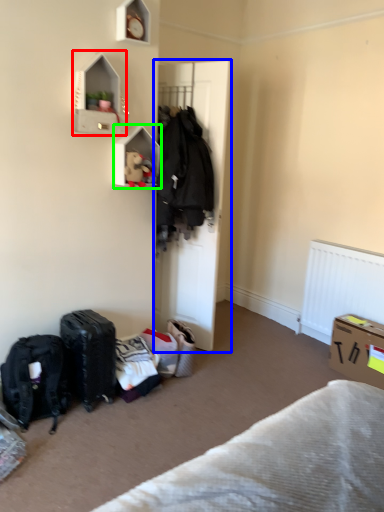
Question: Which object is positioned closest to cabinet (highlighted by a red box)? Select from door (highlighted by a blue box) and shelf (highlighted by a green box).

Choices:
 (A) door
 (B) shelf

Answer: (B)